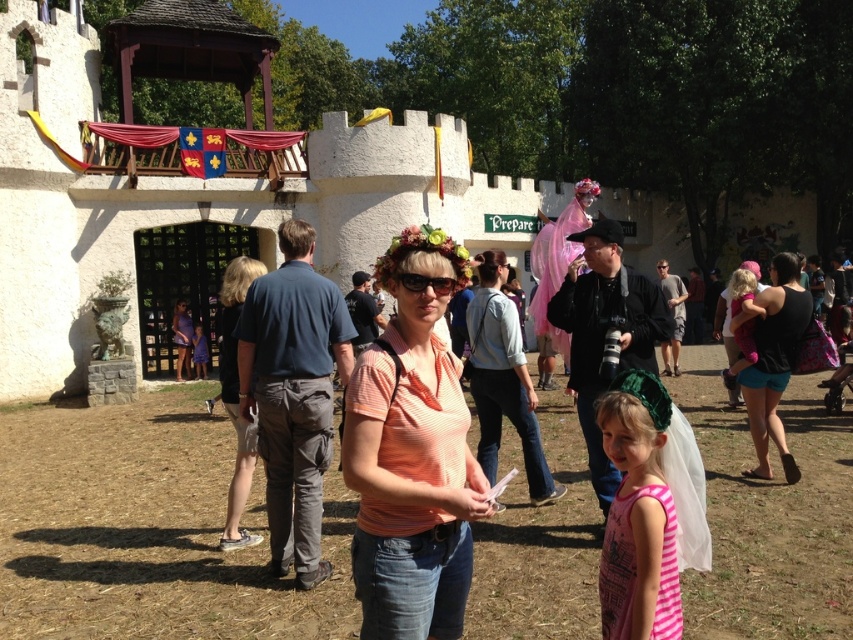
Question: Which point is farther to the camera?

Choices:
 (A) (395, 355)
 (B) (192, 346)

Answer: (B)

Question: Is orange striped shirt at center closer to camera compared to denim shorts at center?

Choices:
 (A) no
 (B) yes

Answer: (B)

Question: Can you confirm if orange striped shirt at center is wider than denim shorts at center?

Choices:
 (A) yes
 (B) no

Answer: (B)

Question: Based on their relative distances, which object is farther from the denim shorts at center?

Choices:
 (A) pink striped dress at lower right
 (B) pink fabric dress at center

Answer: (A)

Question: Which point is farther to the camera?

Choices:
 (A) pink fabric dress at center
 (B) denim shorts at center
 (C) pink striped dress at lower right

Answer: (A)

Question: Is pink striped dress at lower right smaller than denim shorts at center?

Choices:
 (A) yes
 (B) no

Answer: (A)